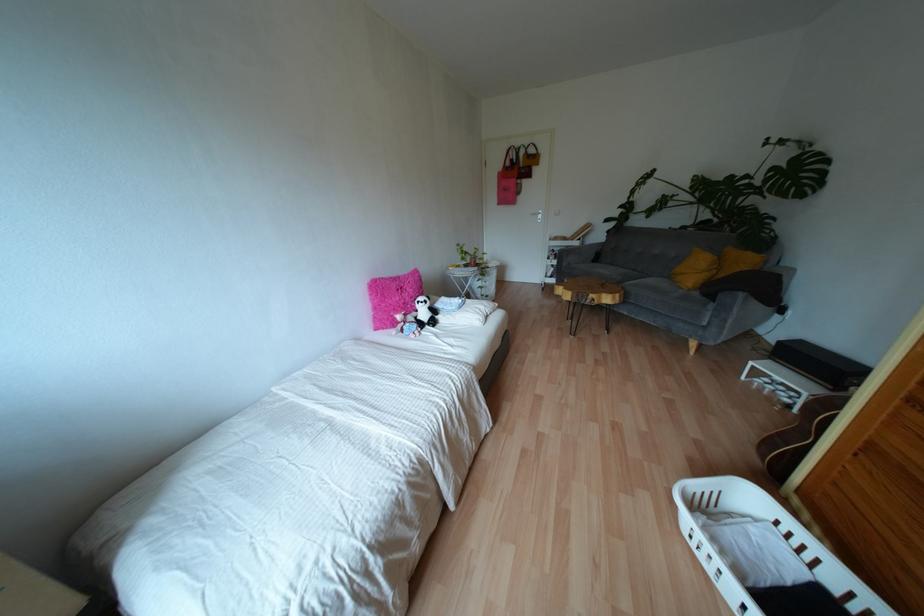
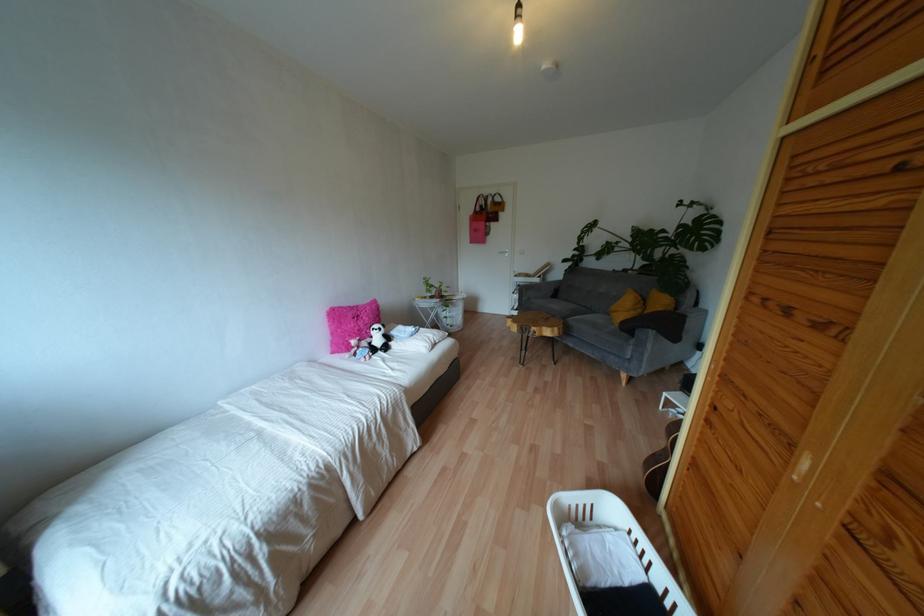
Find the pixel in the second image that matches the point at 739,294 in the first image.

(650, 331)